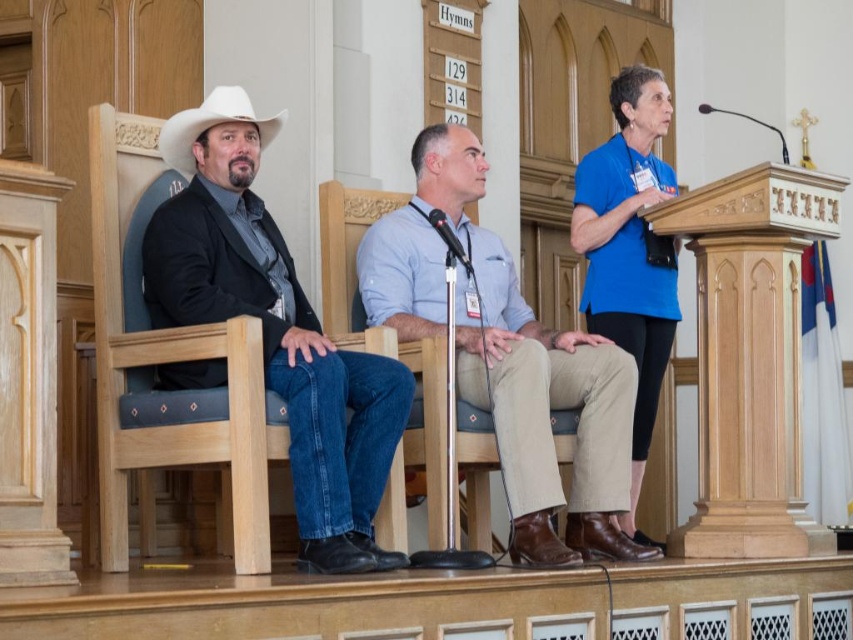
Which is behind, point (389, 428) or point (163, 141)?

Positioned behind is point (163, 141).

Who is more forward, (316, 566) or (225, 96)?

Point (316, 566) is more forward.

Does point (183, 234) come behind point (245, 109)?

That is False.

This screenshot has width=853, height=640. Find the location of `matte black jacket at left`. matte black jacket at left is located at coordinates (276, 330).

Is the position of black plastic microphone at center less distant than that of black plastic microphone at upper right?

Yes, it is in front of black plastic microphone at upper right.

The width and height of the screenshot is (853, 640). I want to click on black plastic microphone at center, so click(450, 240).

What do you see at coordinates (276, 330) in the screenshot?
I see `matte black jacket at left` at bounding box center [276, 330].

Locate an element on the screen. The image size is (853, 640). matte black jacket at left is located at coordinates (276, 330).